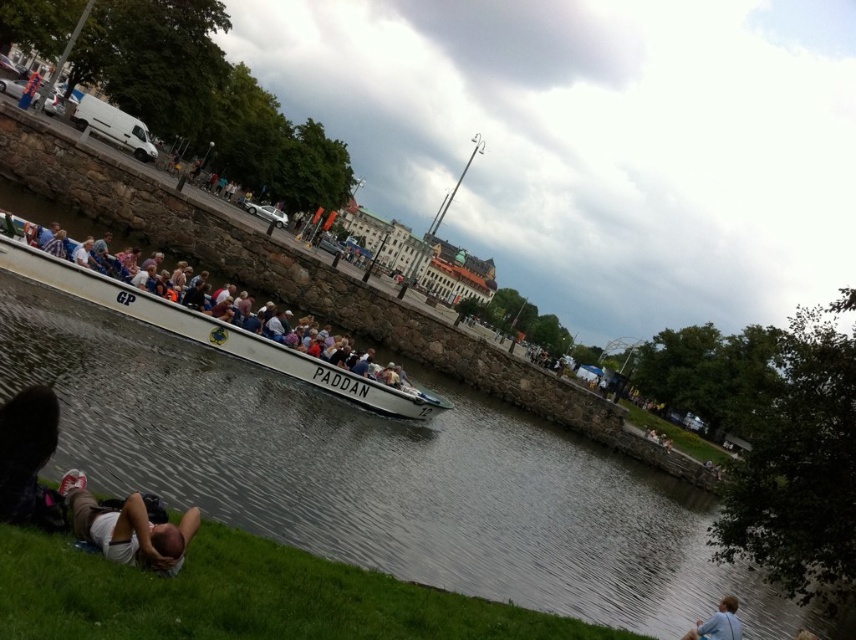
Does white matte boat at center appear under white fabric person at lower left?

Actually, white matte boat at center is above white fabric person at lower left.

Is white matte boat at center positioned at the back of white fabric person at lower left?

Yes, white matte boat at center is further from the viewer.

What are the coordinates of `white matte boat at center` in the screenshot? It's located at (212, 332).

Find the location of a particular element. The height and width of the screenshot is (640, 856). white matte boat at center is located at coordinates (212, 332).

Can you confirm if white fabric person at lower left is taller than blue fabric shirt at lower right?

Incorrect, white fabric person at lower left's height is not larger of blue fabric shirt at lower right's.

You are a GUI agent. You are given a task and a screenshot of the screen. Output one action in this format:
    pyautogui.click(x=<x>, y=<y>)
    Task: Click on the white fabric person at lower left
    The width and height of the screenshot is (856, 640).
    Given the screenshot: What is the action you would take?
    pyautogui.click(x=128, y=529)

Looking at this image, who is more distant from viewer, (97,536) or (726,627)?

The point (726,627) is more distant.

Identify the location of white fabric person at lower left. Image resolution: width=856 pixels, height=640 pixels. (128, 529).

Looking at this image, can you confirm if green grass at lower left is smaller than white matte boat at center?

Correct, green grass at lower left occupies less space than white matte boat at center.

Does green grass at lower left come in front of white matte boat at center?

Yes, green grass at lower left is closer to the viewer.

Which is in front, point (27, 586) or point (80, 278)?

Point (27, 586)

I want to click on green grass at lower left, so click(242, 596).